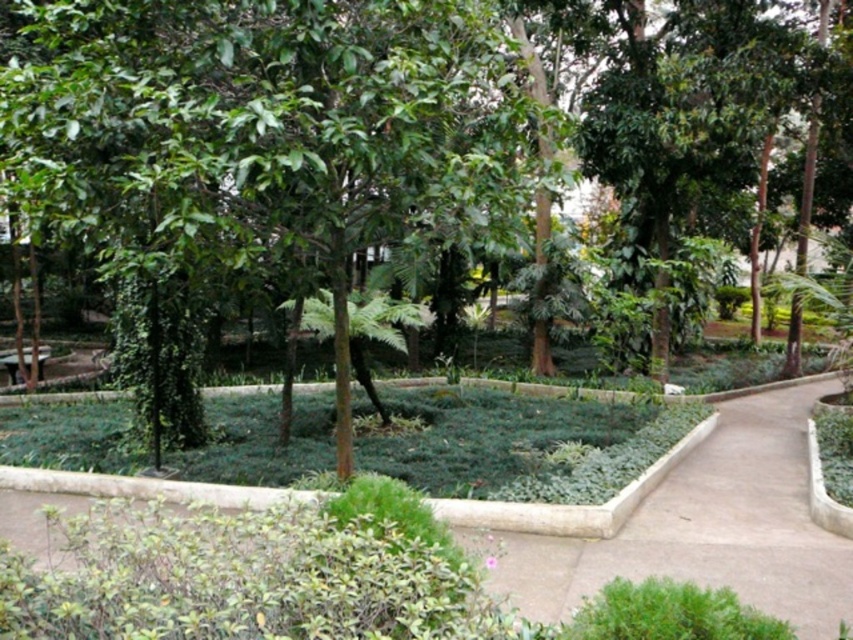
Question: Considering the relative positions of brown concrete path at center and wooden park bench at lower left in the image provided, where is brown concrete path at center located with respect to wooden park bench at lower left?

Choices:
 (A) below
 (B) above

Answer: (A)

Question: Can you confirm if brown concrete path at center is thinner than wooden park bench at lower left?

Choices:
 (A) no
 (B) yes

Answer: (B)

Question: Can you confirm if brown concrete path at center is bigger than wooden park bench at lower left?

Choices:
 (A) yes
 (B) no

Answer: (B)

Question: Among these points, which one is farthest from the camera?

Choices:
 (A) (6, 358)
 (B) (834, 602)

Answer: (A)